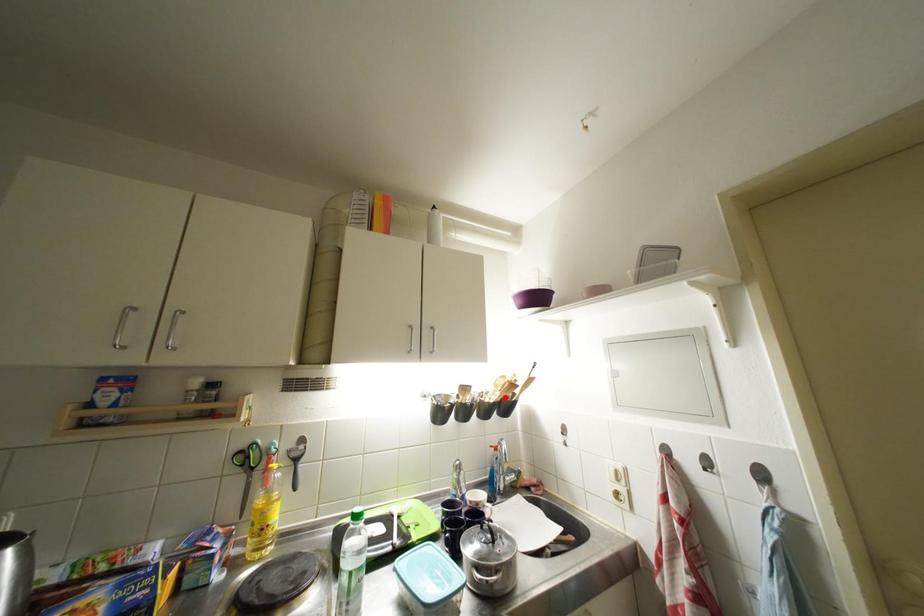
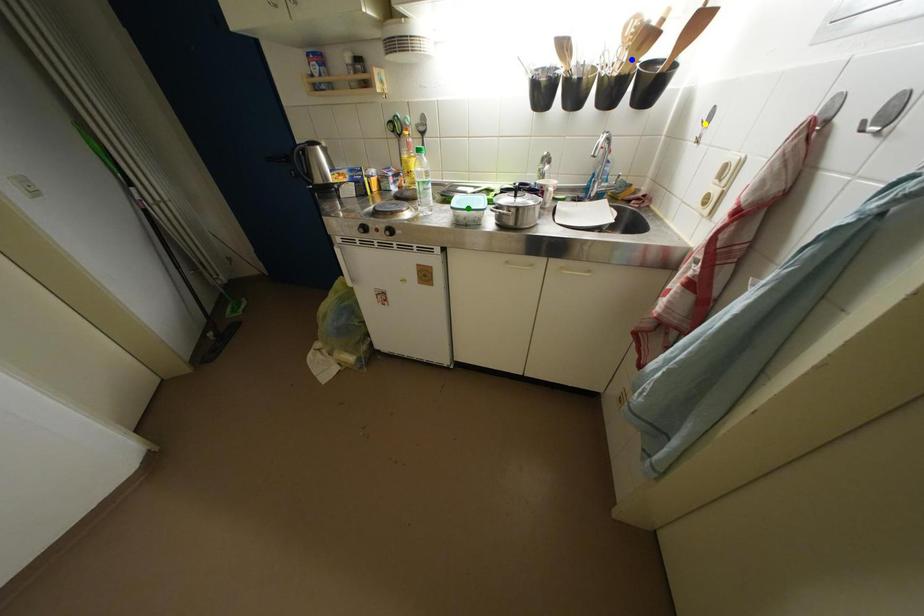
Question: I am providing you with two images of the same scene from different viewpoints. A red point is marked on the first image. You are given multiple points on the second image. Which point in image 2 represents the same 3d spot as the red point in image 1?

Choices:
 (A) blue point
 (B) green point
 (C) yellow point

Answer: (A)